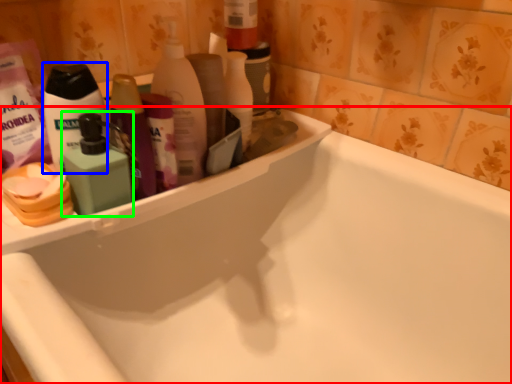
Question: Estimate the real-world distances between objects in this image. Which object is closer to bathtub (highlighted by a red box), toiletry (highlighted by a blue box) or cleaning product (highlighted by a green box)?

Choices:
 (A) toiletry
 (B) cleaning product

Answer: (B)